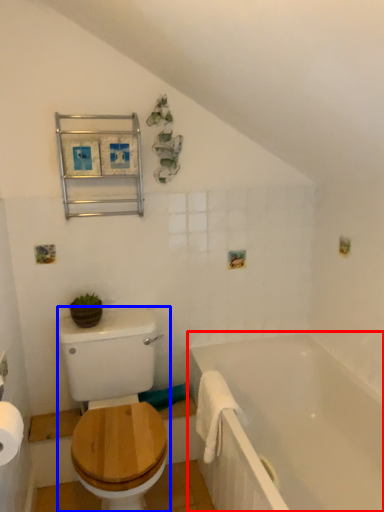
Question: Which object is further to the camera taking this photo, bathtub (highlighted by a red box) or sit (highlighted by a blue box)?

Choices:
 (A) bathtub
 (B) sit

Answer: (B)